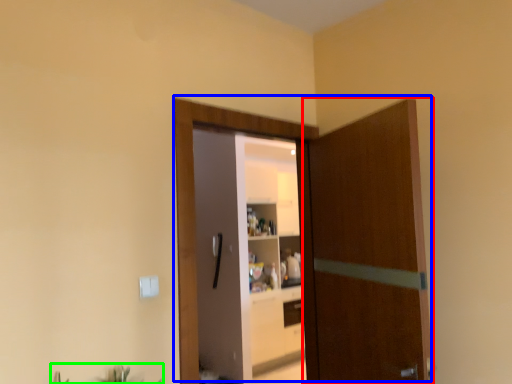
Question: Estimate the real-world distances between objects in this image. Which object is farther from door (highlighted by a red box), door (highlighted by a blue box) or plant (highlighted by a green box)?

Choices:
 (A) door
 (B) plant

Answer: (B)